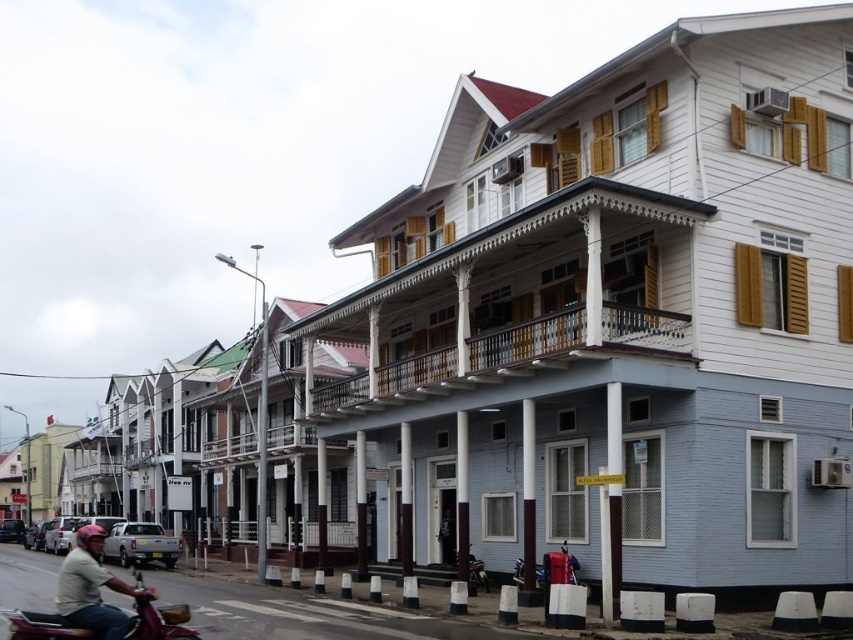
Which is behind, point (178, 605) or point (96, 561)?

The point (178, 605) is more distant.

Which is in front, point (141, 628) or point (108, 612)?

Point (108, 612) is more forward.

This screenshot has width=853, height=640. I want to click on metallic maroon motorcycle at lower left, so click(99, 609).